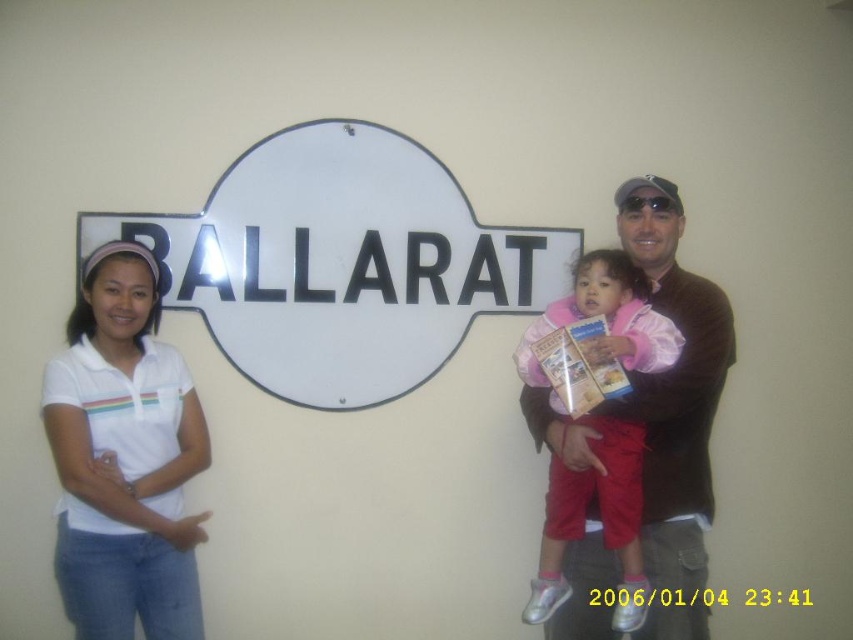
You are a photographer trying to capture a group photo of the white cotton shirt at left and the brown sweater at center. Based on their sizes, which one should you position closer to the camera to ensure both appear equally sized in the photo?

To make the white cotton shirt at left and the brown sweater at center appear equally sized in the photo, position the white cotton shirt at left closer to the camera since it has a lesser width compared to the brown sweater at center.

You are a photographer trying to capture a photo of the white cotton shirt at left and the brown sweater at center. Which one is closer to the camera?

The white cotton shirt at left is closer to the camera because it is in front of the brown sweater at center.